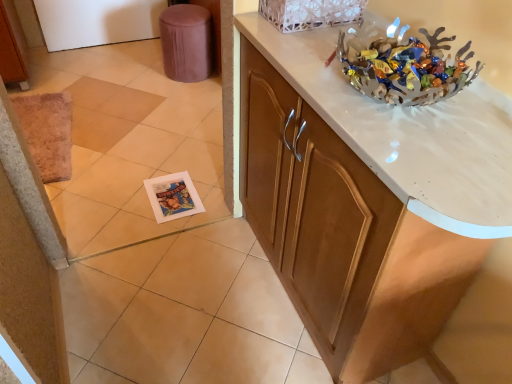
Locate an element on the screen. free space in front of metallic silver bowl at upper right is located at coordinates (433, 145).